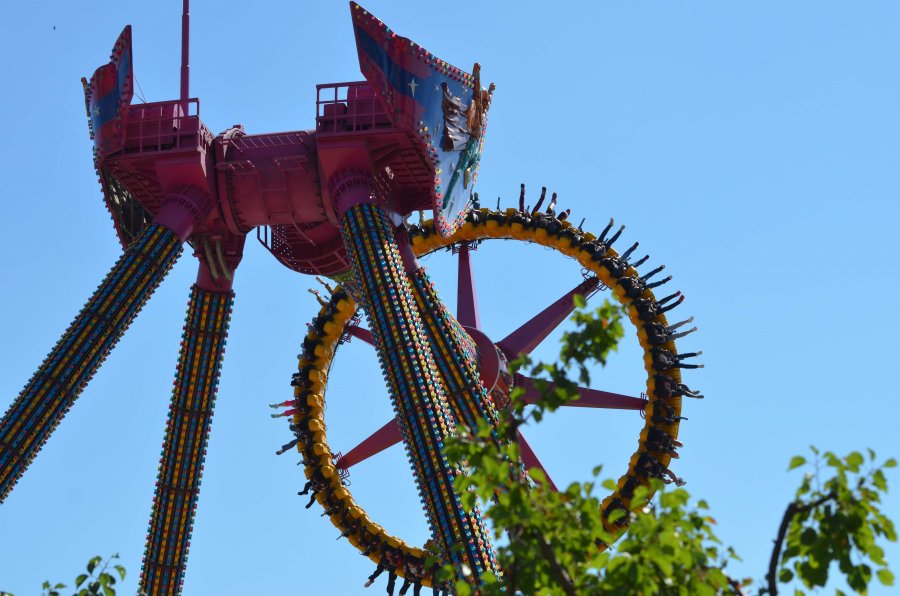
Where is `left front leg`? This screenshot has width=900, height=596. left front leg is located at coordinates (471, 415).